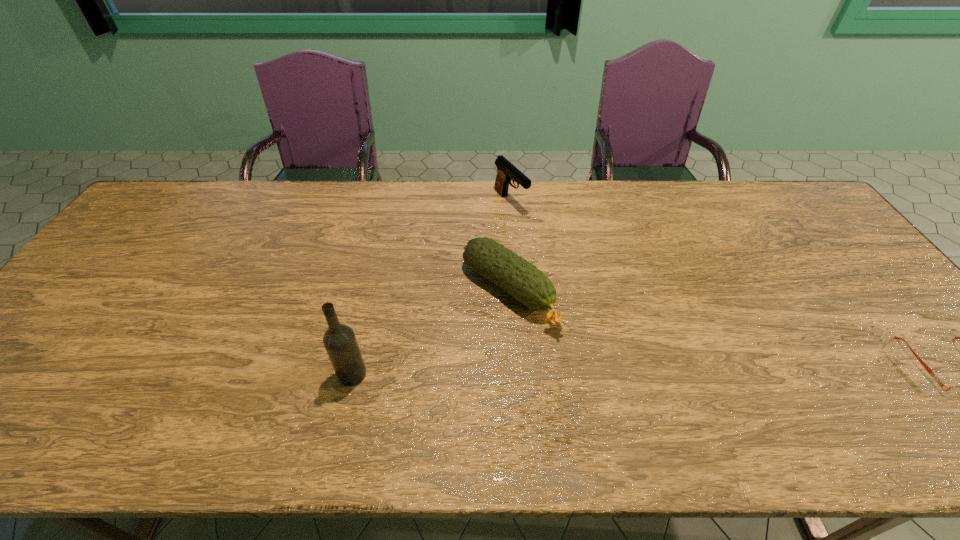
This screenshot has height=540, width=960. I want to click on the leftmost object, so 339,340.

This screenshot has width=960, height=540. What are the coordinates of `the tallest object` in the screenshot? It's located at (339, 340).

You are a GUI agent. You are given a task and a screenshot of the screen. Output one action in this format:
    pyautogui.click(x=<x>, y=<y>)
    Task: Click on the pistol
    This screenshot has width=960, height=540.
    Given the screenshot: What is the action you would take?
    pyautogui.click(x=506, y=171)

The image size is (960, 540). I want to click on the farthest object, so click(x=506, y=171).

You are a GUI agent. You are given a task and a screenshot of the screen. Output one action in this format:
    pyautogui.click(x=<x>, y=<y>)
    Task: Click on the cucumber
    The image size is (960, 540).
    Given the screenshot: What is the action you would take?
    pyautogui.click(x=522, y=280)

This screenshot has width=960, height=540. I want to click on vacant position located on the back of the leftmost object, so click(366, 316).

I want to click on free point located at the barrel of the pistol, so pyautogui.click(x=569, y=264).

What are the coordinates of `vacant space located 0.220m at the barrel of the pistol` in the screenshot? It's located at (562, 255).

Where is `vacant space located 0.150m at the barrel of the pistol`? The image size is (960, 540). vacant space located 0.150m at the barrel of the pistol is located at coordinates [x=547, y=242].

The image size is (960, 540). Find the location of `vacant region located 0.210m at the blossom end of the cucumber`. vacant region located 0.210m at the blossom end of the cucumber is located at coordinates (614, 380).